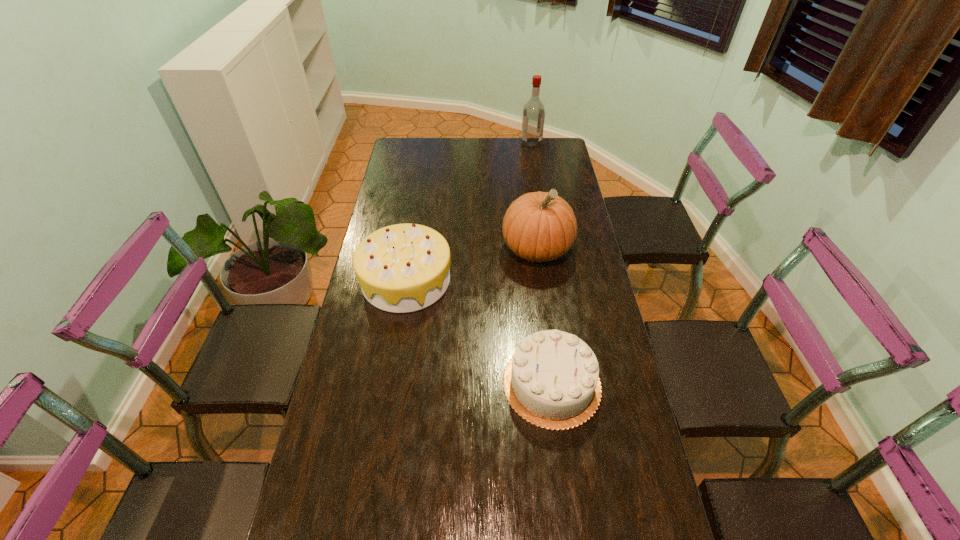
The width and height of the screenshot is (960, 540). Identify the location of free space at the right edge. (603, 377).

Locate an element on the screen. The image size is (960, 540). free space between the taller birthday cake and the third shortest object is located at coordinates (471, 265).

Locate an element on the screen. The image size is (960, 540). free space between the nearest object and the second shortest object is located at coordinates (479, 332).

Image resolution: width=960 pixels, height=540 pixels. I want to click on vacant area that lies between the nearest object and the taller birthday cake, so click(x=479, y=332).

You are a GUI agent. You are given a task and a screenshot of the screen. Output one action in this format:
    pyautogui.click(x=<x>, y=<y>)
    Task: Click on the vacant region between the shortest object and the second tallest object
    
    Given the screenshot: What is the action you would take?
    pyautogui.click(x=544, y=316)

Locate an element on the screen. unoccupied area between the farthest object and the nearest object is located at coordinates (541, 263).

Identify the location of unoccupied position between the farthest object and the nearest object. (541, 263).

Where is `object that stands as the third closest to the pumpkin`? object that stands as the third closest to the pumpkin is located at coordinates (533, 119).

This screenshot has width=960, height=540. I want to click on object that ranks as the second closest to the pumpkin, so click(552, 381).

The image size is (960, 540). Find the location of `free space that satisfies the following two spatial constraints: 1. on the front side of the farther birthday cake; 2. on the left side of the shorter birthday cake`. free space that satisfies the following two spatial constraints: 1. on the front side of the farther birthday cake; 2. on the left side of the shorter birthday cake is located at coordinates (390, 383).